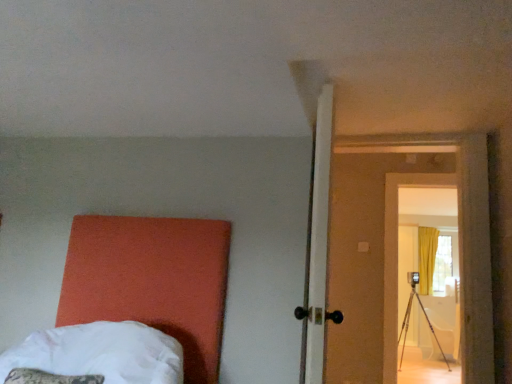
I want to click on free space above wooden door at center-right (from a real-world perspective), so click(338, 99).